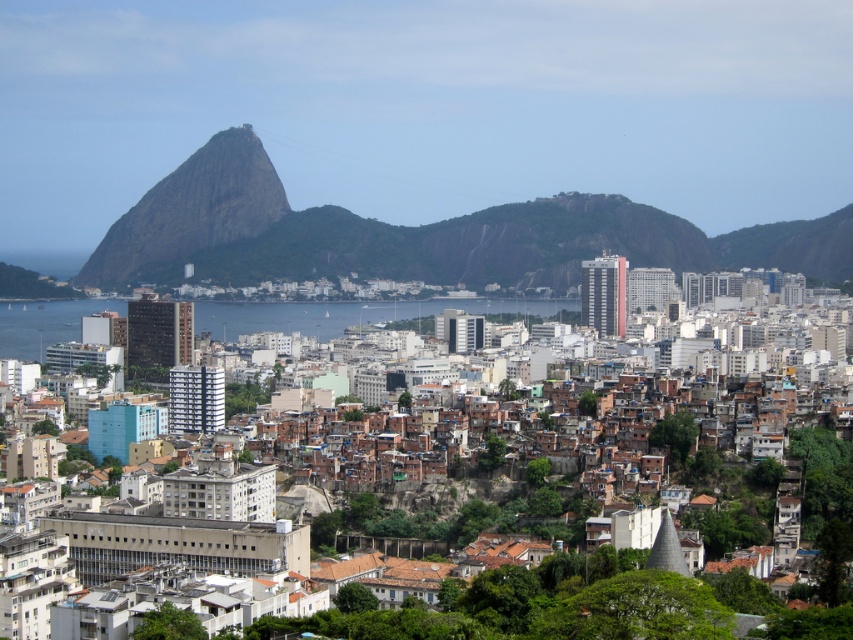
You are a drone operator tasked with capturing aerial shots of Rio de Janeiro. Your mission requires you to fly from the urban area in the foreground to the brown rock formation at upper left marked by point (x=193, y=209). Is the flight path from the urban area to the brown rock formation at upper left clear of any major obstacles like mountains or large water bodies?

The flight path from the urban area to the brown rock formation at upper left is clear of major obstacles like mountains or large water bodies because the middle ground only has a calm body of water separating the urban area from the mountains, and the rock formation is located at the upper left, which is part of the mountainous backdrop. However, the presence of the water body in the middle ground may require the drone to fly over it, but there are no mentioned obstacles blocking the direct path.